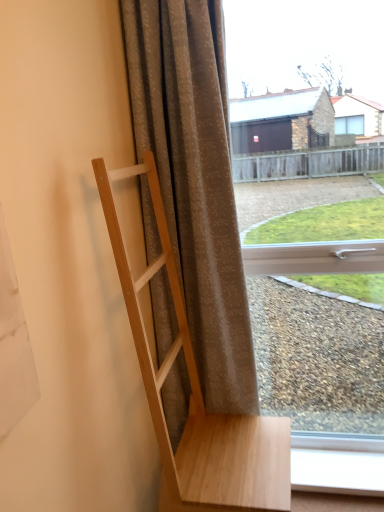
Identify the location of vacant area on top of white plastic window frame at lower right (from a real-world perspective). (337, 466).